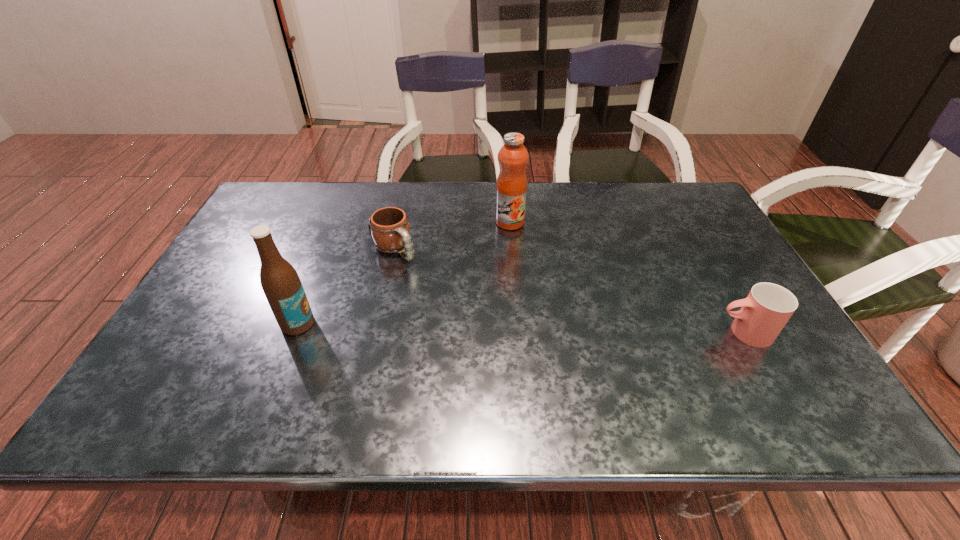
The image size is (960, 540). In order to click on free spot between the shortest object and the farthest object in this screenshot , I will do `click(452, 235)`.

In order to click on vacant space that is in between the second object from left to right and the third object from left to right in this screenshot , I will do 452,235.

This screenshot has height=540, width=960. Find the location of `free spot between the farthest object and the shortest object`. free spot between the farthest object and the shortest object is located at coordinates coord(452,235).

The width and height of the screenshot is (960, 540). Identify the location of vacant area that lies between the mug and the second shortest object. (569, 291).

The image size is (960, 540). What are the coordinates of `unoccupied position between the mug and the beer bottle` in the screenshot? It's located at (347, 286).

Identify the location of object that ranks as the closest to the shortest object. Image resolution: width=960 pixels, height=540 pixels. (280, 282).

Identify which object is located as the second nearest to the cup. Please provide its 2D coordinates. Your answer should be formatted as a tuple, i.e. [(x, y)], where the tuple contains the x and y coordinates of a point satisfying the conditions above.

[(389, 228)]

This screenshot has width=960, height=540. What are the coordinates of `vacant space that satisfies the following two spatial constraints: 1. on the front side of the third nearest object; 2. on the side of the third tallest object with the handle` in the screenshot? It's located at (376, 332).

The image size is (960, 540). I want to click on free space in the image that satisfies the following two spatial constraints: 1. on the back side of the third object from right to left; 2. on the left side of the fruit juice, so (x=400, y=222).

Identify the location of vacant area that satisfies the following two spatial constraints: 1. on the front side of the rightmost object; 2. on the side of the third object from right to left with the handle. The width and height of the screenshot is (960, 540). (376, 332).